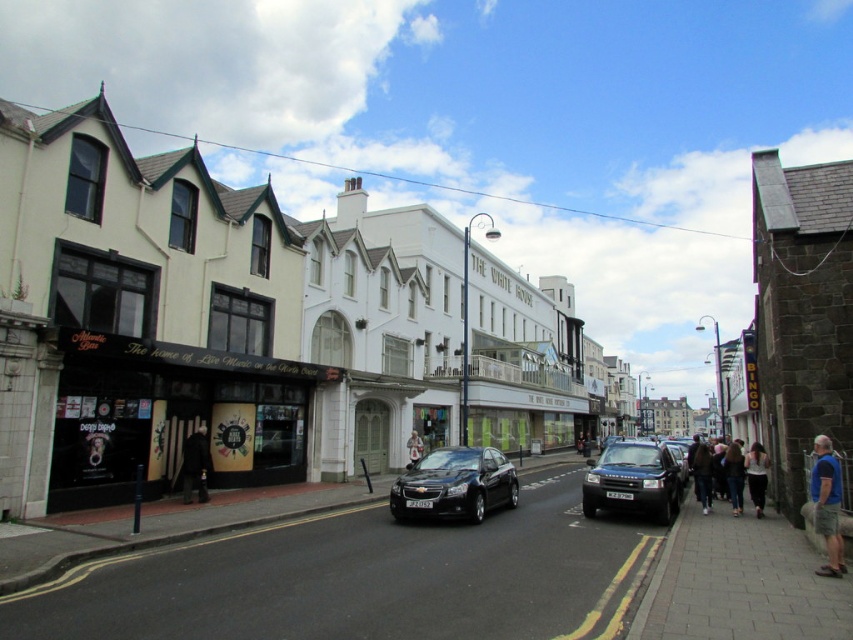
Question: Where is jeans at lower right located in relation to white cotton shirt at center in the image?

Choices:
 (A) above
 (B) below

Answer: (A)

Question: Is metallic gray suv at center-right wider than white cotton shirt at lower right?

Choices:
 (A) no
 (B) yes

Answer: (B)

Question: Which point appears farthest from the camera in this image?

Choices:
 (A) (602, 497)
 (B) (285, 433)

Answer: (B)

Question: Which point is closer to the camera?

Choices:
 (A) (815, 438)
 (B) (674, 483)
 (C) (199, 476)
 (D) (100, 236)

Answer: (A)

Question: Does shiny black sedan at center have a greater width compared to jeans at lower right?

Choices:
 (A) yes
 (B) no

Answer: (A)

Question: Which of the following is the closest to the observer?

Choices:
 (A) jeans at lower right
 (B) blue fabric shirt at lower right
 (C) white cotton shirt at center
 (D) black matte coat at center

Answer: (B)